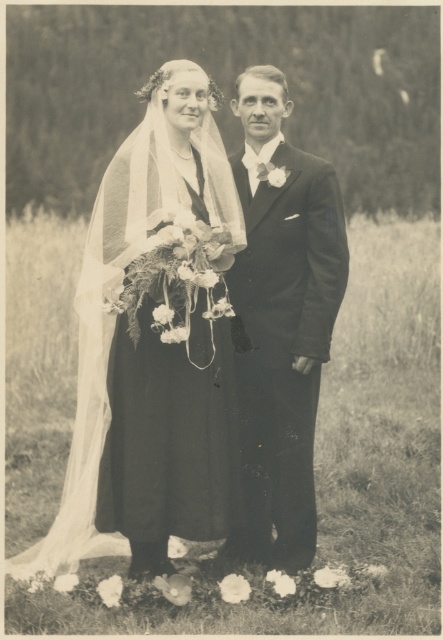
Which is below, smooth black suit at center or silky satin dress at center?

Positioned lower is silky satin dress at center.

Does point (240, 168) come farther from viewer compared to point (217, 442)?

Yes.

Who is more distant from viewer, (x=286, y=275) or (x=179, y=371)?

Point (x=286, y=275)

Image resolution: width=443 pixels, height=640 pixels. In order to click on smooth black suit at center in this screenshot , I will do [282, 321].

Does point (164, 422) come in front of point (280, 108)?

That is True.

Measure the distance between matte black dress at center and camera.

3.68 meters

Between point (181, 365) and point (279, 385), which one is positioned behind?

The point (279, 385) is behind.

What are the coordinates of `matte black dress at center` in the screenshot? It's located at (233, 369).

Which of these two, matte black dress at center or silky satin dress at center, stands shorter?

silky satin dress at center

Does matte black dress at center have a lesser width compared to silky satin dress at center?

No, matte black dress at center is not thinner than silky satin dress at center.

Describe the element at coordinates (233, 369) in the screenshot. I see `matte black dress at center` at that location.

You are a GUI agent. You are given a task and a screenshot of the screen. Output one action in this format:
    pyautogui.click(x=<x>, y=<y>)
    Task: Click on the matte black dress at center
    
    Given the screenshot: What is the action you would take?
    pyautogui.click(x=233, y=369)